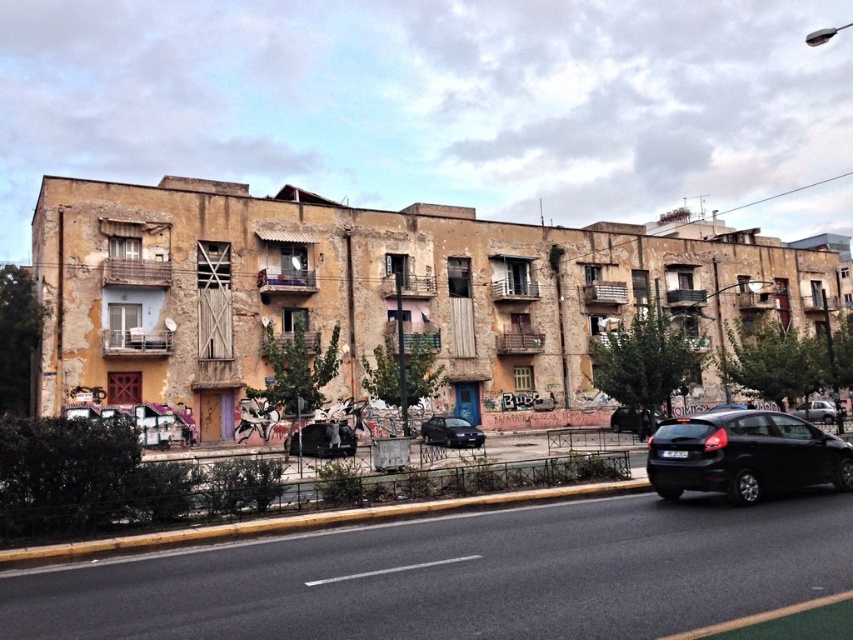
Who is lower down, metallic black car at center or silver metallic sedan at center-right?

metallic black car at center is below.

Does metallic black car at center appear on the left side of silver metallic sedan at center-right?

Correct, you'll find metallic black car at center to the left of silver metallic sedan at center-right.

Which is in front, point (334, 454) or point (836, 412)?

Point (334, 454) is in front.

At what (x,y) coordinates should I click in order to perform the action: click on metallic black car at center. Please return your answer as a coordinate pair (x, y). Looking at the image, I should click on (326, 440).

Locate an element on the screen. The width and height of the screenshot is (853, 640). black matte hatchback at lower right is located at coordinates (744, 456).

Does point (675, 460) come in front of point (804, 412)?

Yes, it is.

Locate an element on the screen. black matte hatchback at lower right is located at coordinates (744, 456).

Measure the distance between black matte hatchback at lower right and metallic black car at center.

20.57 meters

Is point (747, 445) positioned after point (299, 432)?

That is False.

Who is more distant from viewer, (718, 417) or (320, 428)?

The point (320, 428) is more distant.

Locate an element on the screen. The height and width of the screenshot is (640, 853). black matte hatchback at lower right is located at coordinates (744, 456).